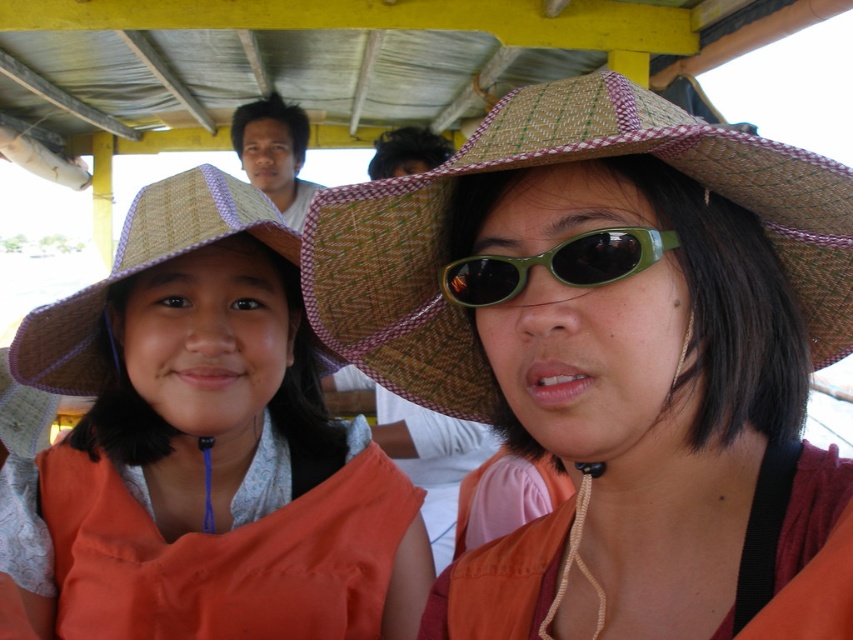
Who is higher up, woven straw hat at left or green matte sunglasses at center?

green matte sunglasses at center is above.

Is woven straw hat at left wider than green matte sunglasses at center?

Correct, the width of woven straw hat at left exceeds that of green matte sunglasses at center.

Is point (248, 188) farther from viewer compared to point (474, 292)?

That is True.

Identify the location of woven straw hat at left. This screenshot has width=853, height=640. (141, 269).

Who is lower down, brown woven straw hat at center or green matte sunglasses at center?

brown woven straw hat at center is lower down.

From the picture: Does brown woven straw hat at center appear over green matte sunglasses at center?

No, brown woven straw hat at center is not above green matte sunglasses at center.

Who is more distant from viewer, [480,410] or [601,272]?

Positioned behind is point [480,410].

Where is `brown woven straw hat at center`? brown woven straw hat at center is located at coordinates (550, 164).

How much distance is there between matte straw hat at center and brown woven straw hat at center?

matte straw hat at center is 13.78 inches away from brown woven straw hat at center.

In the scene shown: Is matte straw hat at center below brown woven straw hat at center?

Indeed, matte straw hat at center is positioned under brown woven straw hat at center.

Where is `matte straw hat at center`? matte straw hat at center is located at coordinates (202, 449).